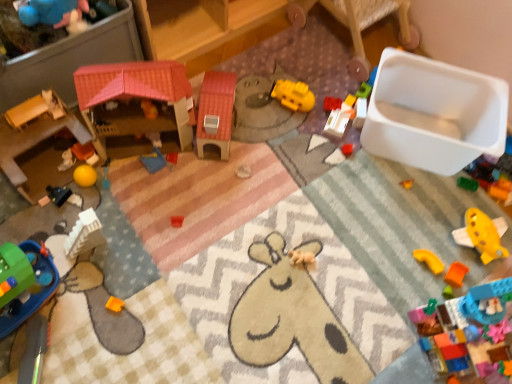
Where is `vacant area that lies between green plastic toy at lower left, acting as the second toy starting from the left, and white plastic container at center, acting as the 10th toy starting from the left`? Image resolution: width=512 pixels, height=384 pixels. vacant area that lies between green plastic toy at lower left, acting as the second toy starting from the left, and white plastic container at center, acting as the 10th toy starting from the left is located at coordinates (207, 200).